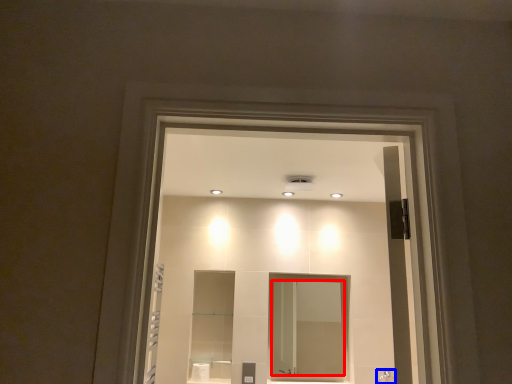
Question: Which of the following is the farthest to the observer, mirror (highlighted by a red box) or shower (highlighted by a blue box)?

Choices:
 (A) mirror
 (B) shower

Answer: (A)